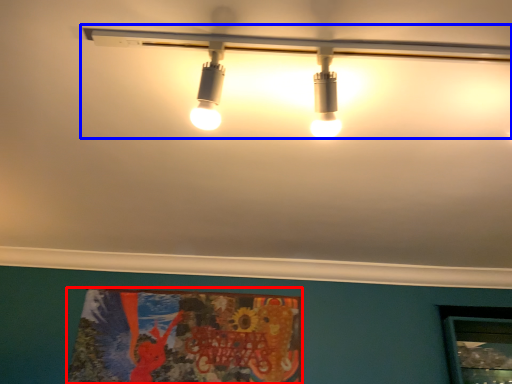
Question: Which of the following is the closest to the observer, poster page (highlighted by a red box) or lamp (highlighted by a blue box)?

Choices:
 (A) poster page
 (B) lamp

Answer: (B)